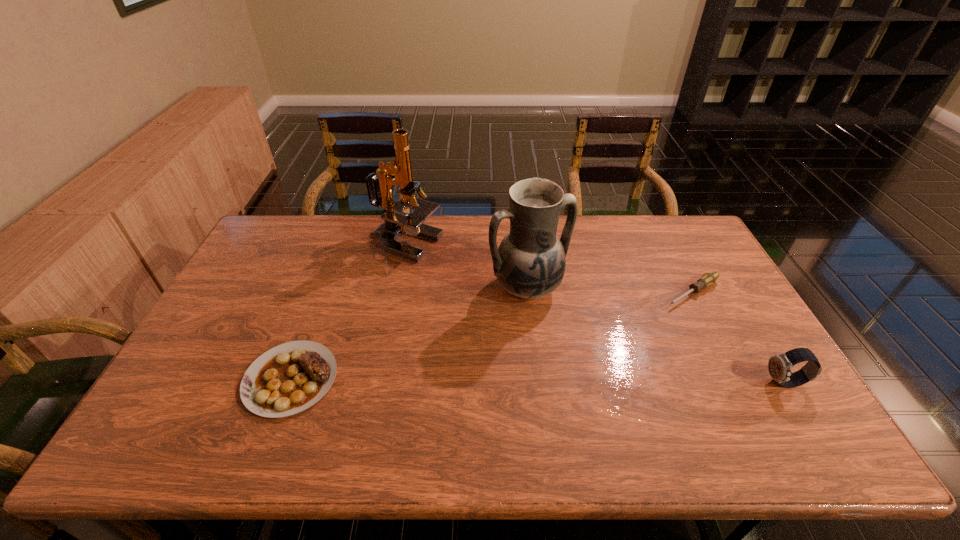
Find the location of `free spot between the steak and the third object from right to left`. free spot between the steak and the third object from right to left is located at coordinates (409, 333).

Identify which object is the second closest to the watch. Please provide its 2D coordinates. Your answer should be formatted as a tuple, i.e. [(x, y)], where the tuple contains the x and y coordinates of a point satisfying the conditions above.

[(530, 262)]

Find the location of a particular element. This screenshot has width=960, height=540. the second closest object to the fourth shortest object is located at coordinates (707, 279).

You are a GUI agent. You are given a task and a screenshot of the screen. Output one action in this format:
    pyautogui.click(x=<x>, y=<y>)
    Task: Click on the blank area in the image that satisfies the following two spatial constraints: 1. on the back side of the pitcher; 2. on the left side of the steak
    
    Given the screenshot: What is the action you would take?
    pyautogui.click(x=325, y=288)

What are the coordinates of `vacant space that satisfies the following two spatial constraints: 1. on the front side of the third object from left to right; 2. on the right side of the farthest object` in the screenshot? It's located at (396, 288).

In order to click on free location that satisfies the following two spatial constraints: 1. on the front side of the third shortest object; 2. on the face of the farthest object in this screenshot , I will do `click(376, 383)`.

Image resolution: width=960 pixels, height=540 pixels. I want to click on vacant space that satisfies the following two spatial constraints: 1. on the front side of the third tallest object; 2. on the face of the farthest object, so point(376,383).